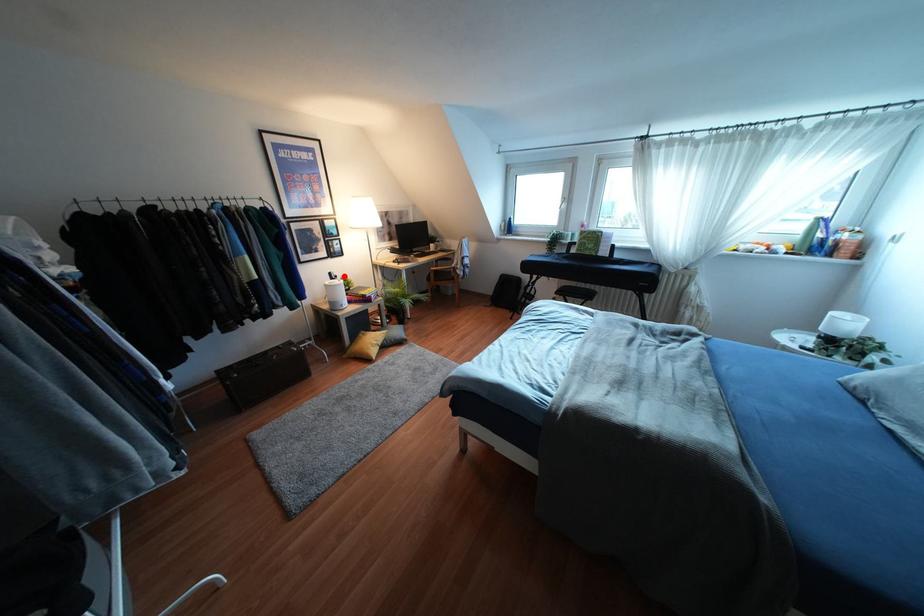
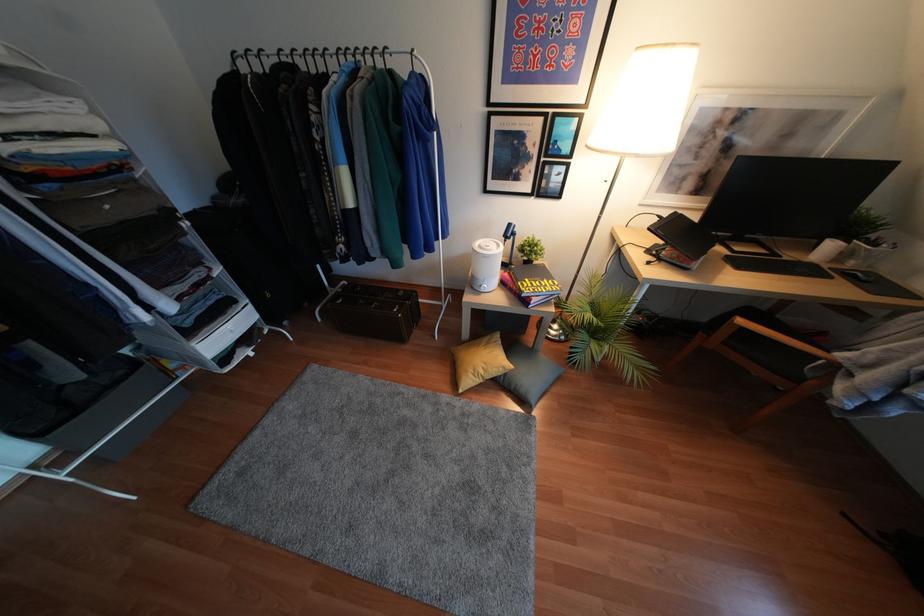
The point at the highlighted location is marked in the first image. Where is the corresponding point in the second image?

(536, 237)